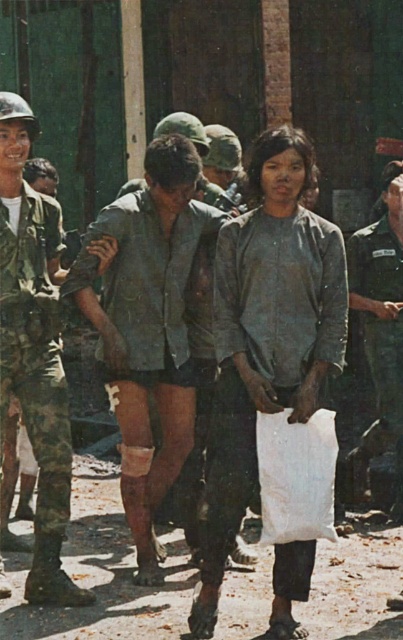
Describe the element at coordinates (149, 328) in the screenshot. The width and height of the screenshot is (403, 640). I see `camouflage fabric shirt at center` at that location.

Can you confirm if camouflage fabric shirt at center is taller than worn fabric shirt at center?

Yes.

What do you see at coordinates (149, 328) in the screenshot?
I see `camouflage fabric shirt at center` at bounding box center [149, 328].

The height and width of the screenshot is (640, 403). I want to click on camouflage fabric shirt at center, so click(149, 328).

Is gray cotton shirt at center above camouflage fabric shirt at center?

Incorrect, gray cotton shirt at center is not positioned above camouflage fabric shirt at center.

How much distance is there between gray cotton shirt at center and camouflage fabric shirt at center?

gray cotton shirt at center is 28.79 inches away from camouflage fabric shirt at center.

What do you see at coordinates (265, 337) in the screenshot?
I see `gray cotton shirt at center` at bounding box center [265, 337].

Image resolution: width=403 pixels, height=640 pixels. I want to click on gray cotton shirt at center, so pyautogui.click(x=265, y=337).

Between camouflage fabric shirt at center and camouflage uniform at center, which one is positioned lower?

camouflage fabric shirt at center

Is camouflage fabric shirt at center wider than camouflage uniform at center?

Yes, camouflage fabric shirt at center is wider than camouflage uniform at center.

Is point (193, 241) positioned in front of point (384, 368)?

Yes, it is in front of point (384, 368).

The width and height of the screenshot is (403, 640). Find the location of `camouflage fabric shirt at center`. camouflage fabric shirt at center is located at coordinates (149, 328).